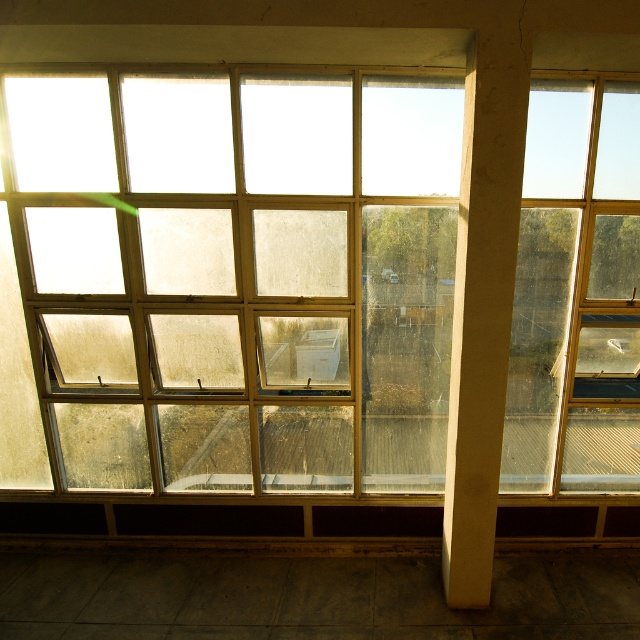
You are standing in a room with a large window divided into panes. You notice a point marked at coordinates (x=228, y=280). Based on the scene description, can you determine what object or feature this point is pointing to?

The point at coordinates (x=228, y=280) corresponds to the clear glass window at center, as stated in the objects description.

You are an architect designing a new building. You want to ensure that the clear glass window at center allows enough natural light into the room while considering the height of the white concrete pillar at center. Based on the image, which object is taller and might block more light?

The white concrete pillar at center is taller than the clear glass window at center, so it might block more light.

You are a painter standing 3 meters away from the clear glass window at center. You want to paint the window but need to be at least 4 meters away to ensure proper perspective. Can you move back to meet this requirement?

The distance between the clear glass window at center and the camera is 4.16 meters, so the painter is already 4.16 meters away, which is more than the required 4 meters. Therefore, the painter can paint the window without moving back.